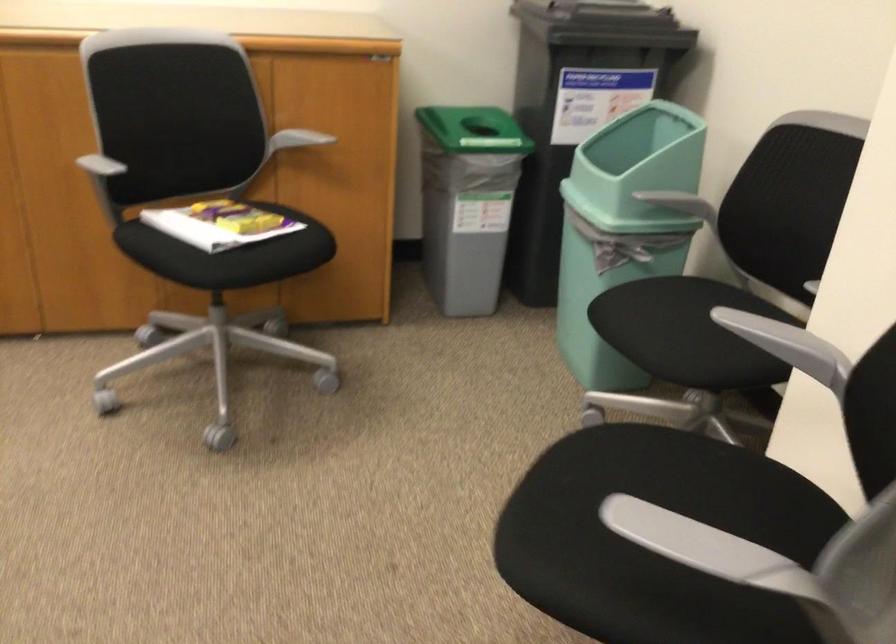
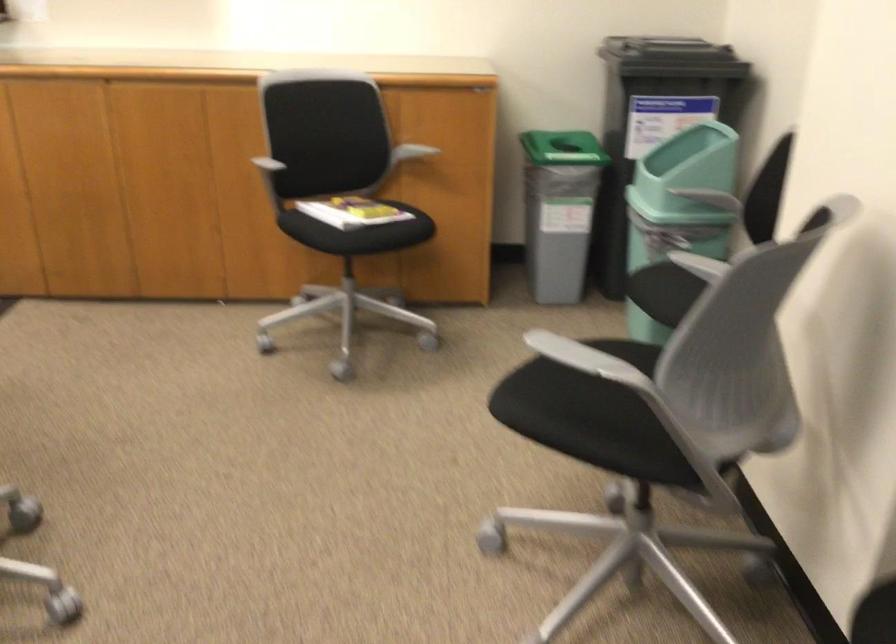
Locate, in the second image, the point that corresponds to point 765,325 in the first image.

(705, 263)